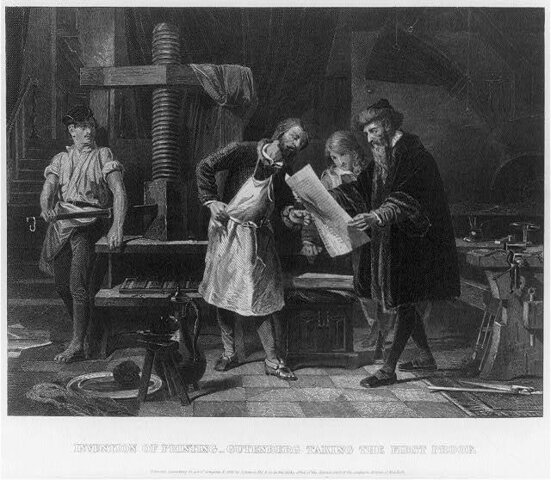
This screenshot has width=551, height=480. What are the coordinates of `staircase` in the screenshot? It's located at (37, 170).